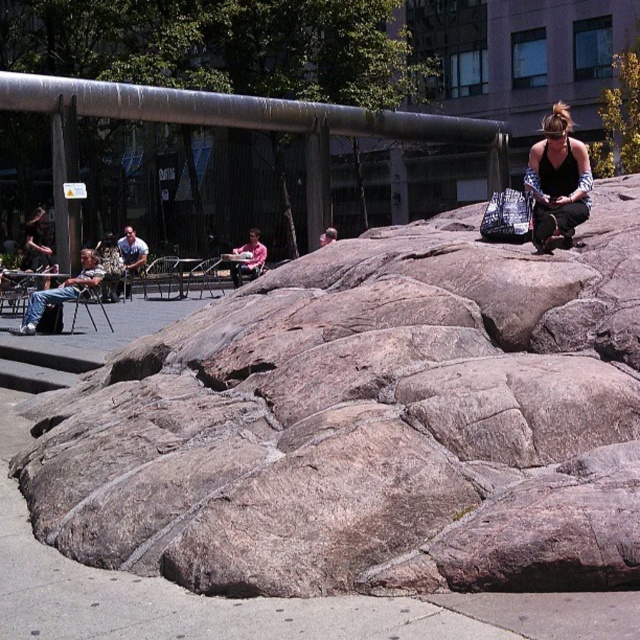
Question: Based on their relative distances, which object is nearer to the matte gray chair at left?

Choices:
 (A) matte black tank top at upper right
 (B) gray rough rock at center
 (C) pink fabric stroller at center

Answer: (C)

Question: Which object is positioned farthest from the pink fabric stroller at center?

Choices:
 (A) gray rough rock at center
 (B) matte black tank top at upper right

Answer: (B)

Question: Can you confirm if gray rough rock at center is bigger than matte gray chair at left?

Choices:
 (A) no
 (B) yes

Answer: (B)

Question: Which point appears farthest from the camera in this image?

Choices:
 (A) (81, 268)
 (B) (260, 250)
 (C) (403, 573)

Answer: (B)

Question: Does matte black tank top at upper right lie behind matte gray chair at left?

Choices:
 (A) no
 (B) yes

Answer: (A)

Question: Does matte black tank top at upper right come in front of pink fabric stroller at center?

Choices:
 (A) yes
 (B) no

Answer: (A)